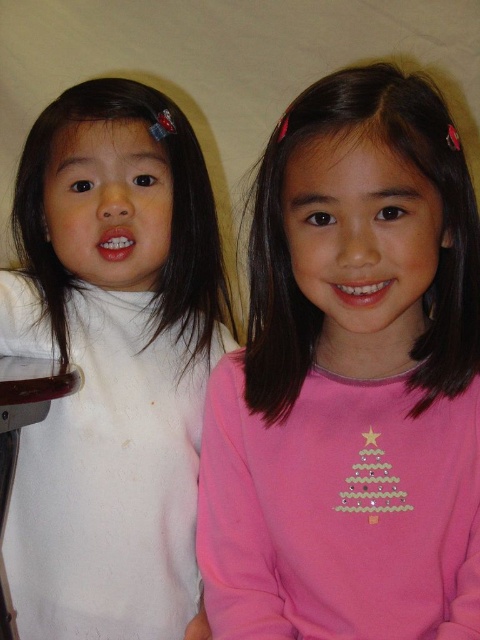
Question: Can you confirm if pink matte shirt at center is wider than white soft sweater at left?

Choices:
 (A) yes
 (B) no

Answer: (A)

Question: Among these objects, which one is farthest from the camera?

Choices:
 (A) white soft sweater at left
 (B) pink matte shirt at center

Answer: (A)

Question: Can you confirm if pink matte shirt at center is positioned to the left of white soft sweater at left?

Choices:
 (A) yes
 (B) no

Answer: (B)

Question: Among these points, which one is nearest to the camera?

Choices:
 (A) (25, 554)
 (B) (410, 512)

Answer: (B)

Question: Does pink matte shirt at center have a greater width compared to white soft sweater at left?

Choices:
 (A) yes
 (B) no

Answer: (A)